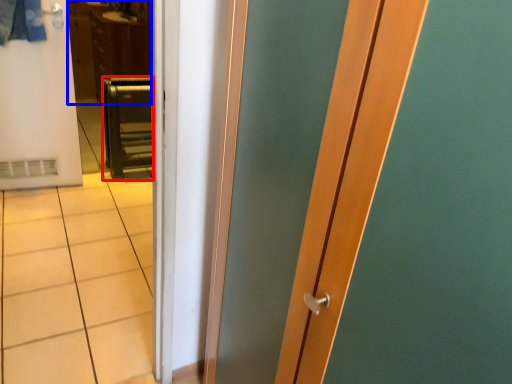
Question: Among these objects, which one is nearest to the camera, furniture (highlighted by a red box) or dresser (highlighted by a blue box)?

Choices:
 (A) furniture
 (B) dresser

Answer: (A)